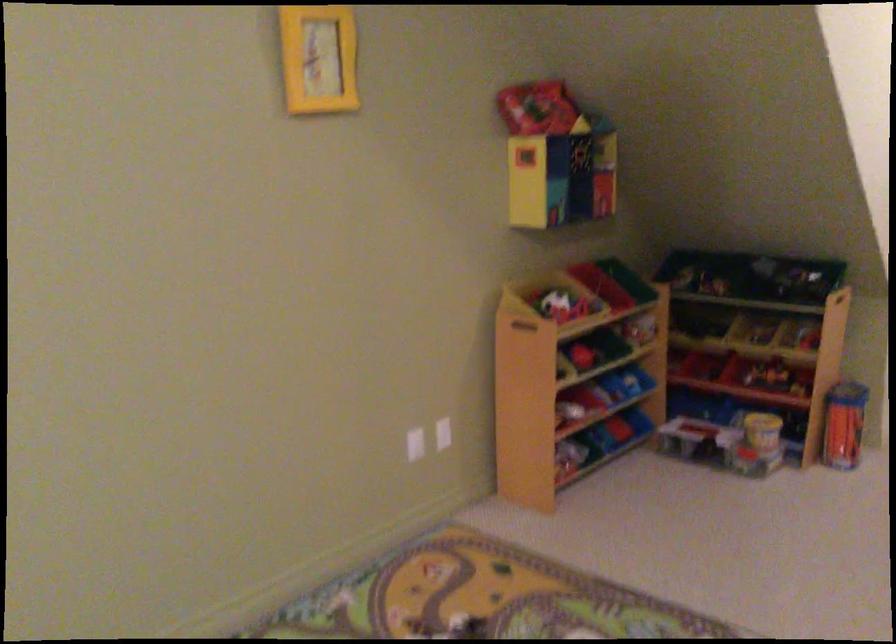
What are the coordinates of `yellow toy bin` in the screenshot? It's located at (561, 178).